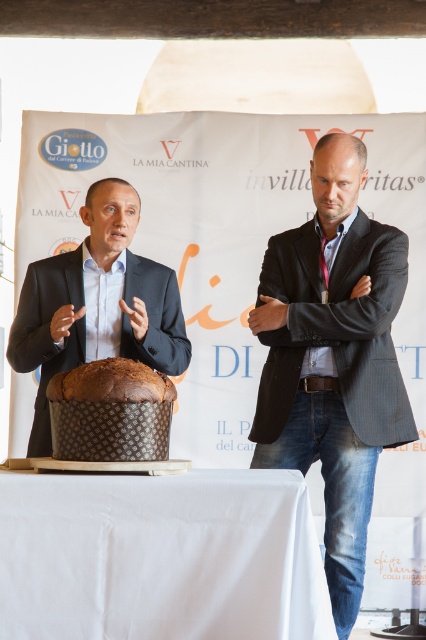
Question: Which object appears closest to the camera in this image?

Choices:
 (A) brown textured chocolate cake at center
 (B) brown textured bread at center
 (C) black pinstripe blazer at center
 (D) dark brown textured panettone at center

Answer: (A)

Question: Is brown textured chocolate cake at center wider than brown textured bread at center?

Choices:
 (A) yes
 (B) no

Answer: (B)

Question: Which object appears closest to the camera in this image?

Choices:
 (A) dark brown textured panettone at center
 (B) brown textured bread at center

Answer: (B)

Question: Is black pinstripe blazer at center further to camera compared to matte black suit at center?

Choices:
 (A) yes
 (B) no

Answer: (A)

Question: Which point is farther to the camera?

Choices:
 (A) (92, 275)
 (B) (54, 378)

Answer: (A)

Question: Where is white cloth at lower center located in relation to matte black suit at center in the image?

Choices:
 (A) below
 (B) above

Answer: (A)